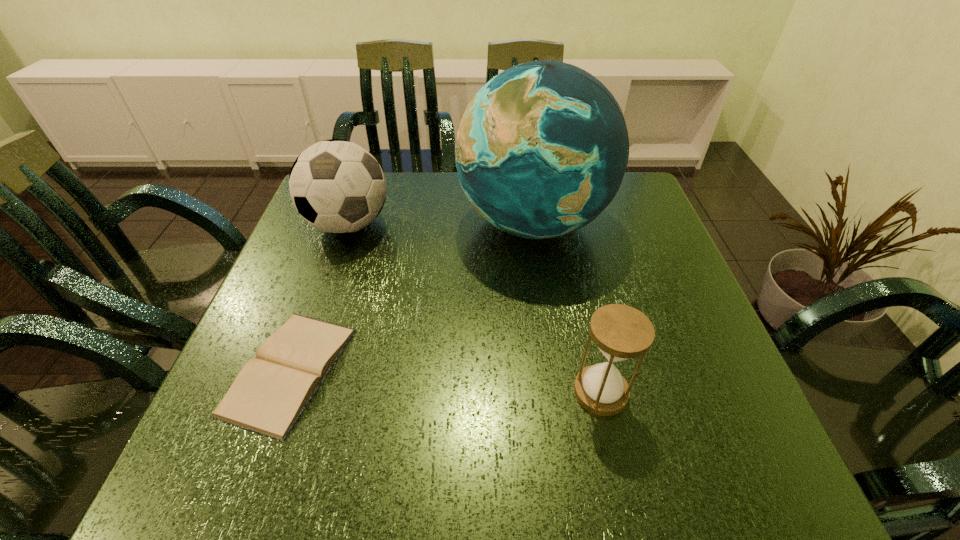
This screenshot has width=960, height=540. I want to click on vacant space at the near right corner, so click(x=669, y=435).

You are a GUI agent. You are given a task and a screenshot of the screen. Output one action in this format:
    pyautogui.click(x=<x>, y=<y>)
    Task: Click on the vacant area that lies between the second shortest object and the shortest object
    
    Given the screenshot: What is the action you would take?
    pyautogui.click(x=445, y=381)

This screenshot has height=540, width=960. In order to click on blank region between the tallest object and the hourglass in this screenshot , I will do `click(566, 307)`.

Image resolution: width=960 pixels, height=540 pixels. I want to click on free space between the hourglass and the globe, so click(566, 307).

Locate an element on the screen. vacant area that lies between the Bible and the globe is located at coordinates (412, 296).

Identify the location of vacant space that is in between the soccer ball and the Bible. This screenshot has width=960, height=540. (319, 298).

Where is `vacant area between the shortest object and the tallest object`? vacant area between the shortest object and the tallest object is located at coordinates (412, 296).

Image resolution: width=960 pixels, height=540 pixels. Find the location of `vacant area between the tallest object and the Bible`. vacant area between the tallest object and the Bible is located at coordinates point(412,296).

At what (x,y) coordinates should I click in order to perform the action: click on vacant area that lies between the Bible and the soccer ball. Please return your answer as a coordinate pair (x, y). Looking at the image, I should click on (319, 298).

Where is `free area in between the globe and the shortest object`? Image resolution: width=960 pixels, height=540 pixels. free area in between the globe and the shortest object is located at coordinates (412, 296).